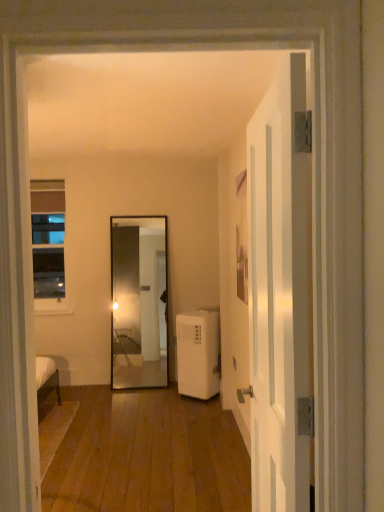
Question: From a real-world perspective, relative to clear glass window at left, is white glossy door at right vertically above or below?

Choices:
 (A) below
 (B) above

Answer: (A)

Question: Considering the positions of white glossy door at right and clear glass window at left in the image, is white glossy door at right wider or thinner than clear glass window at left?

Choices:
 (A) wide
 (B) thin

Answer: (A)

Question: Which of these objects is positioned farthest from the white glossy door at right?

Choices:
 (A) clear glass window at left
 (B) white plastic air conditioner at lower right

Answer: (A)

Question: Which object is positioned farthest from the white plastic air conditioner at lower right?

Choices:
 (A) white glossy door at right
 (B) clear glass window at left

Answer: (A)